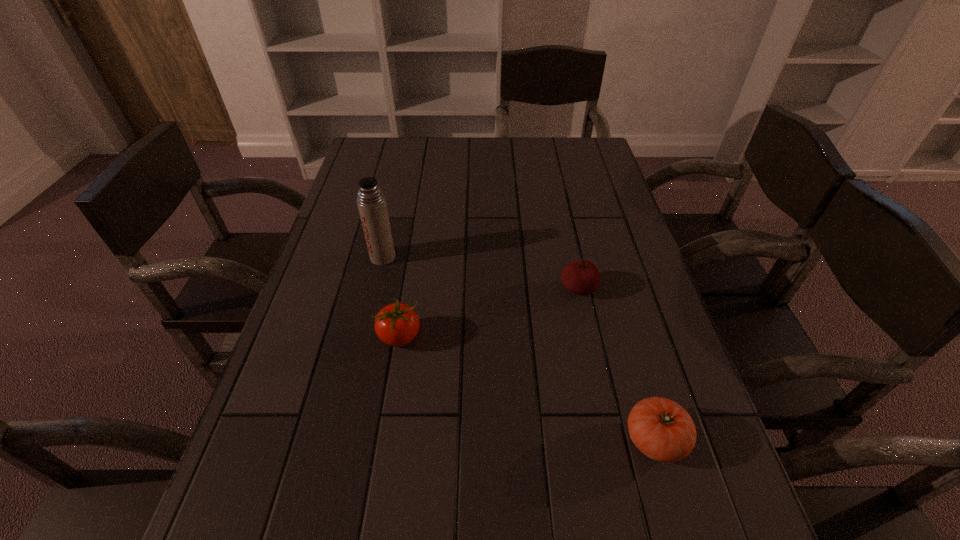
Image resolution: width=960 pixels, height=540 pixels. I want to click on vacant point located between the nearest tomato and the second nearest object, so click(x=527, y=388).

Find the location of a particular element. The height and width of the screenshot is (540, 960). empty location between the tallest object and the second farthest tomato is located at coordinates (392, 297).

Image resolution: width=960 pixels, height=540 pixels. Find the location of `empty space between the leftmost tomato and the nearest tomato`. empty space between the leftmost tomato and the nearest tomato is located at coordinates (527, 388).

Locate an element on the screen. The width and height of the screenshot is (960, 540). vacant area that lies between the farthest tomato and the tallest object is located at coordinates (481, 273).

You are a GUI agent. You are given a task and a screenshot of the screen. Output one action in this format:
    pyautogui.click(x=<x>, y=<y>)
    Task: Click on the vacant space in between the third nearest object and the second nearest object
    
    Given the screenshot: What is the action you would take?
    pyautogui.click(x=490, y=313)

Where is `object that is the second closest to the third nearest object`? The image size is (960, 540). object that is the second closest to the third nearest object is located at coordinates (397, 324).

This screenshot has width=960, height=540. Find the location of `the second closest object to the tallest object`. the second closest object to the tallest object is located at coordinates (582, 277).

Point out which tomato is positioned as the second nearest to the nearest tomato. Please provide its 2D coordinates. Your answer should be formatted as a tuple, i.e. [(x, y)], where the tuple contains the x and y coordinates of a point satisfying the conditions above.

[(397, 324)]

Image resolution: width=960 pixels, height=540 pixels. Identify the location of tomato that is the third closest to the tallest object. (661, 429).

I want to click on free space that satisfies the following two spatial constraints: 1. on the front side of the nearest object; 2. on the left side of the leftmost tomato, so click(383, 440).